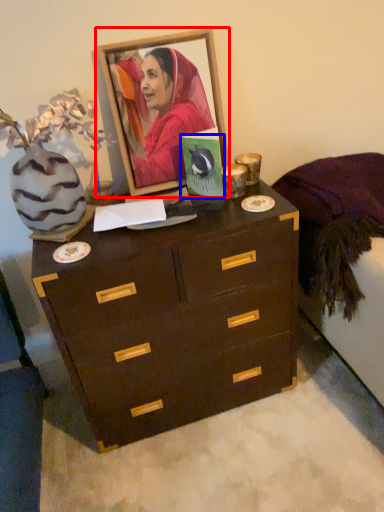
Question: Which point is further to the camera, picture frame (highlighted by a red box) or postcard (highlighted by a blue box)?

Choices:
 (A) picture frame
 (B) postcard

Answer: (B)